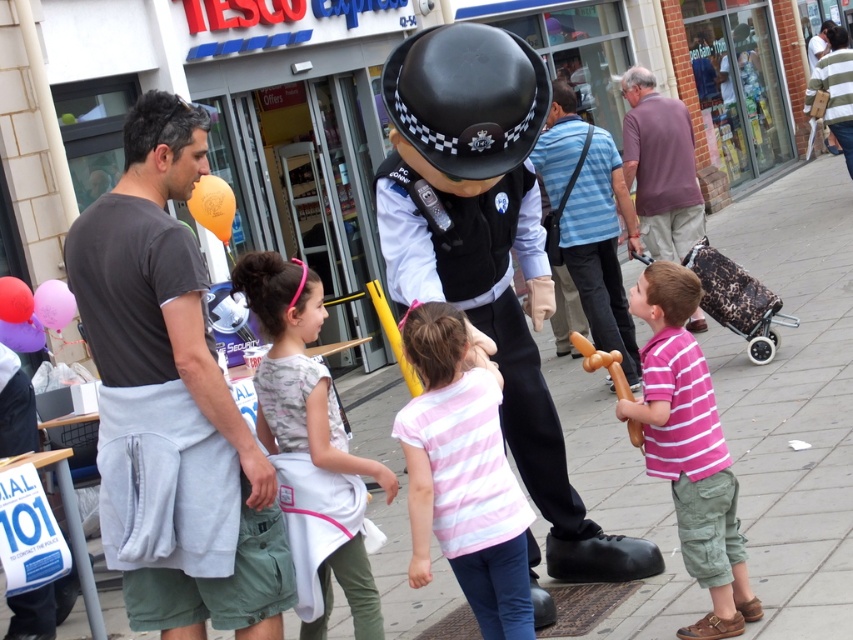
Question: Is shiny black helmet at center smaller than pink striped shirt at lower right?

Choices:
 (A) no
 (B) yes

Answer: (A)

Question: Among these objects, which one is nearest to the camera?

Choices:
 (A) purple cotton shirt at right
 (B) striped cotton shirt at center
 (C) shiny black helmet at center

Answer: (C)

Question: Can you confirm if pink striped shirt at lower right is positioned above purple cotton shirt at right?

Choices:
 (A) no
 (B) yes

Answer: (A)

Question: Which point is closer to the camera taking this photo?

Choices:
 (A) (291, 344)
 (B) (647, 188)
 (C) (584, 176)

Answer: (A)

Question: Can you confirm if shiny black helmet at center is bigger than pink striped shirt at lower right?

Choices:
 (A) yes
 (B) no

Answer: (A)

Question: Which of the following is the closest to the observer?

Choices:
 (A) shiny black helmet at center
 (B) pink fabric dress at center
 (C) purple cotton shirt at right

Answer: (A)